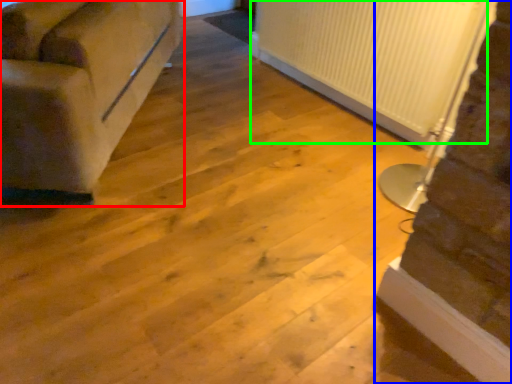
Question: Considering the real-world distances, which object is farthest from studio couch (highlighted by a red box)? stairwell (highlighted by a blue box) or radiator (highlighted by a green box)?

Choices:
 (A) stairwell
 (B) radiator

Answer: (A)